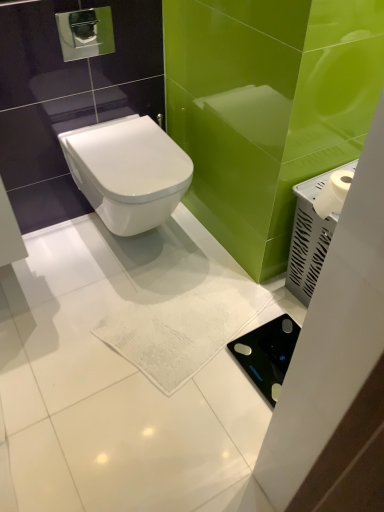
This screenshot has height=512, width=384. What are the coordinates of `empty space that is ontop of white glossy toilet at center` in the screenshot? It's located at (132, 147).